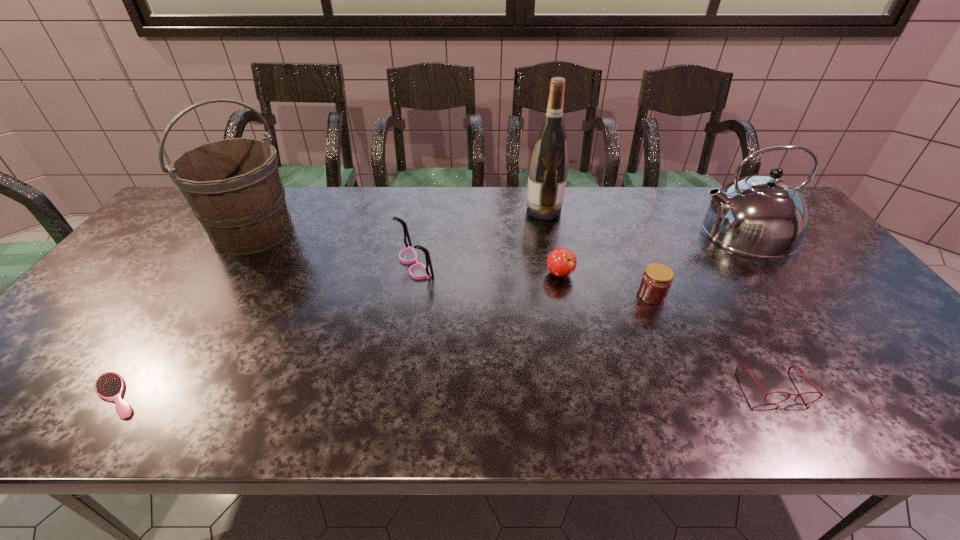
What are the coordinates of `vacant point at the near edge` in the screenshot? It's located at (224, 408).

You are a GUI agent. You are given a task and a screenshot of the screen. Output one action in this format:
    pyautogui.click(x=<x>, y=<y>)
    Task: Click on the vacant space at the left edge
    
    Given the screenshot: What is the action you would take?
    coord(83,323)

Locate an element on the screen. The image size is (960, 540). vacant area at the right edge is located at coordinates (846, 306).

Identify the location of vacant area between the wine bottle and the fourth tallest object. (479, 237).

Where is `free point between the jam and the apple`? free point between the jam and the apple is located at coordinates (606, 285).

The image size is (960, 540). Find the location of `free spot between the fourth tallest object and the hairbrush`. free spot between the fourth tallest object and the hairbrush is located at coordinates (266, 330).

Where is `free space between the apple and the kettle`? free space between the apple and the kettle is located at coordinates (652, 252).

Locate an element on the screen. This screenshot has height=540, width=960. vacant area that lies between the third tallest object and the right spectacles is located at coordinates (759, 307).

Find the location of a particular element. The width and height of the screenshot is (960, 540). vacant area between the hairbrush and the bucket is located at coordinates tap(184, 313).

Where is `free space between the kettle and the nearer spectacles`? This screenshot has height=540, width=960. free space between the kettle and the nearer spectacles is located at coordinates (759, 307).